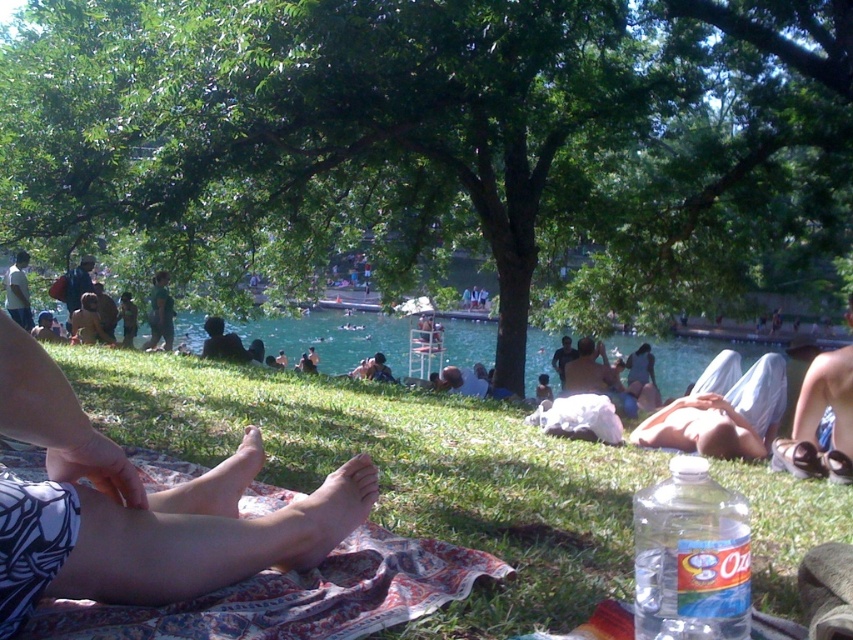
Question: Is dark hair at center wider than dark green shirt at center?

Choices:
 (A) yes
 (B) no

Answer: (B)

Question: Which of these objects is positioned closest to the green fabric shirt at center?

Choices:
 (A) light beige cotton shorts at lower right
 (B) brown leather jacket at lower left
 (C) dark hair at center
 (D) skinny white legs at lower left

Answer: (B)

Question: Among these points, which one is farthest from the camera?

Choices:
 (A) (210, 324)
 (B) (24, 266)
 (C) (744, 424)

Answer: (B)

Question: Which is farther from the green fabric shirt at center?

Choices:
 (A) light beige cotton shorts at lower right
 (B) brown leather jacket at lower left
 (C) green leafy tree at center
 (D) dark hair at center

Answer: (A)

Question: Observing the image, what is the correct spatial positioning of green fabric shirt at center in reference to dark green shirt at center?

Choices:
 (A) right
 (B) left

Answer: (A)

Question: Is green fabric shirt at center thinner than dark green shirt at center?

Choices:
 (A) yes
 (B) no

Answer: (A)